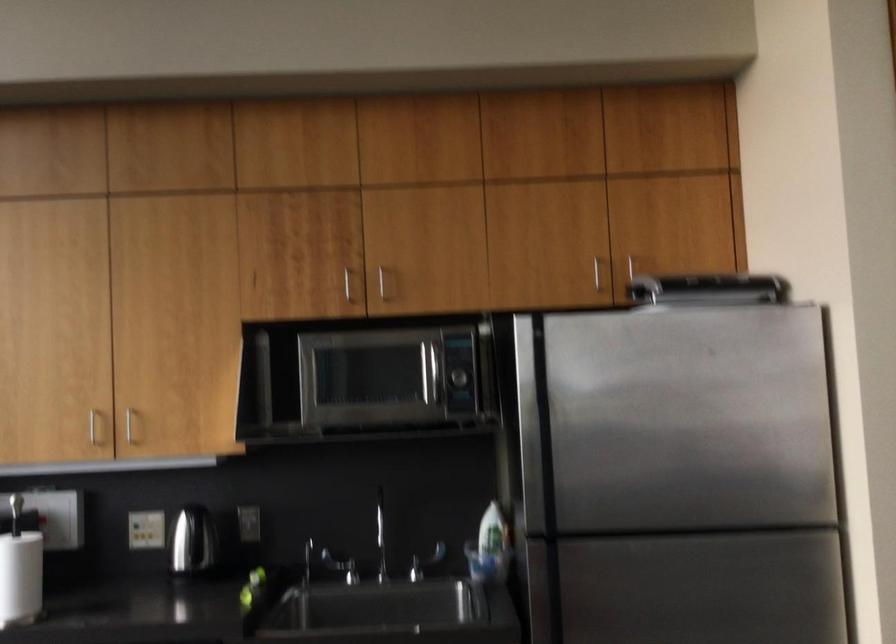
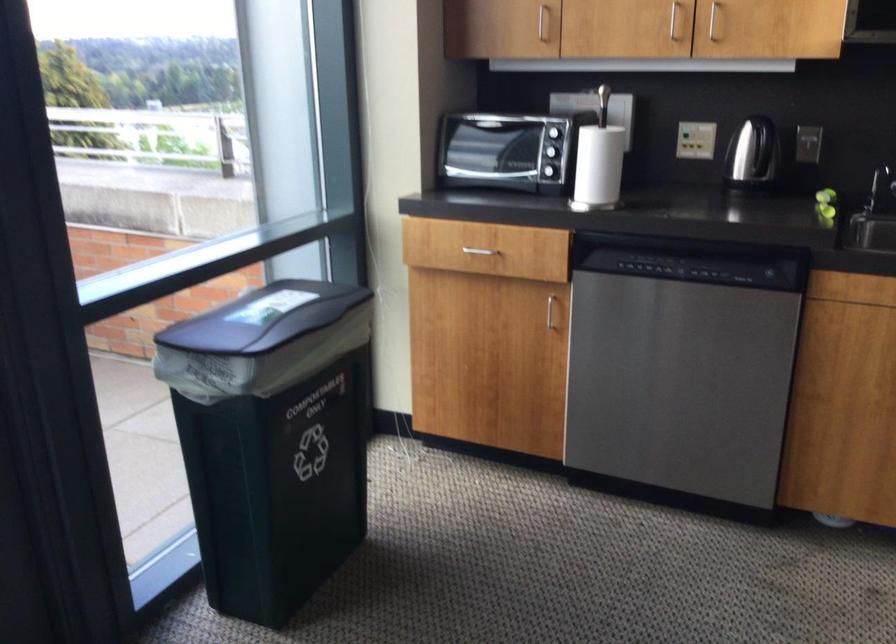
The point at (139, 533) is marked in the first image. Where is the corresponding point in the second image?

(695, 140)